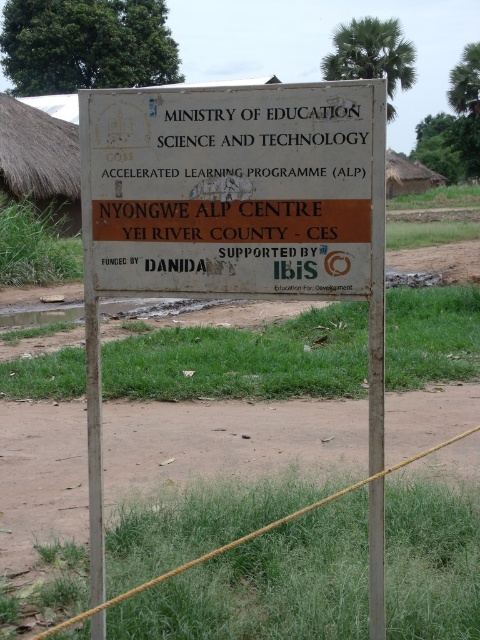
Question: Which of the following is the closest to the observer?

Choices:
 (A) (141, 196)
 (B) (287, 211)

Answer: (B)

Question: Can you confirm if white wooden sign at center is smaller than white painted wood sign at center?

Choices:
 (A) yes
 (B) no

Answer: (B)

Question: Which point is farther from the camera taking this photo?

Choices:
 (A) (343, 90)
 (B) (204, 131)

Answer: (B)

Question: Which point is closer to the camera?

Choices:
 (A) white wooden sign at center
 (B) white painted wood sign at center

Answer: (B)

Question: Is white wooden sign at center below white painted wood sign at center?

Choices:
 (A) no
 (B) yes

Answer: (B)

Question: Is white wooden sign at center in front of white painted wood sign at center?

Choices:
 (A) yes
 (B) no

Answer: (B)